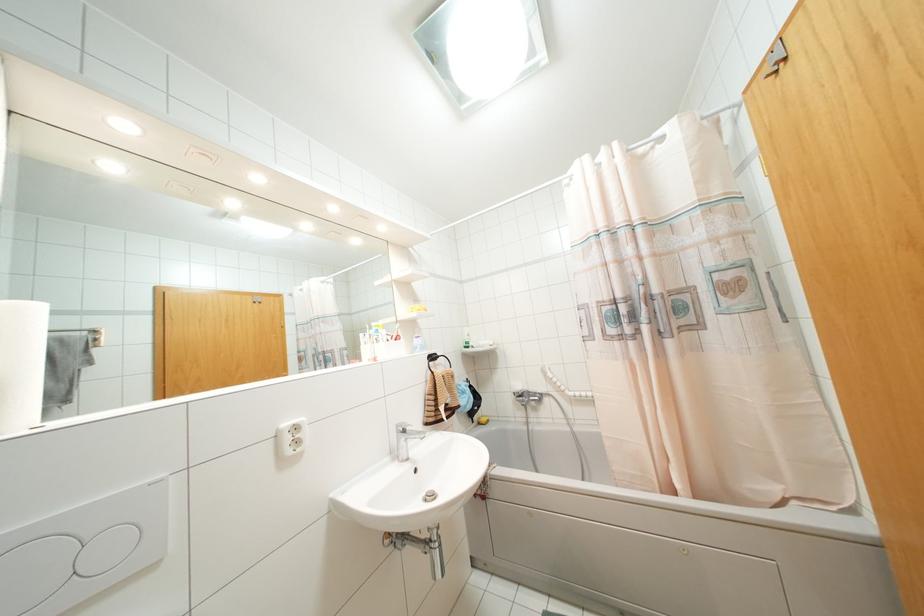
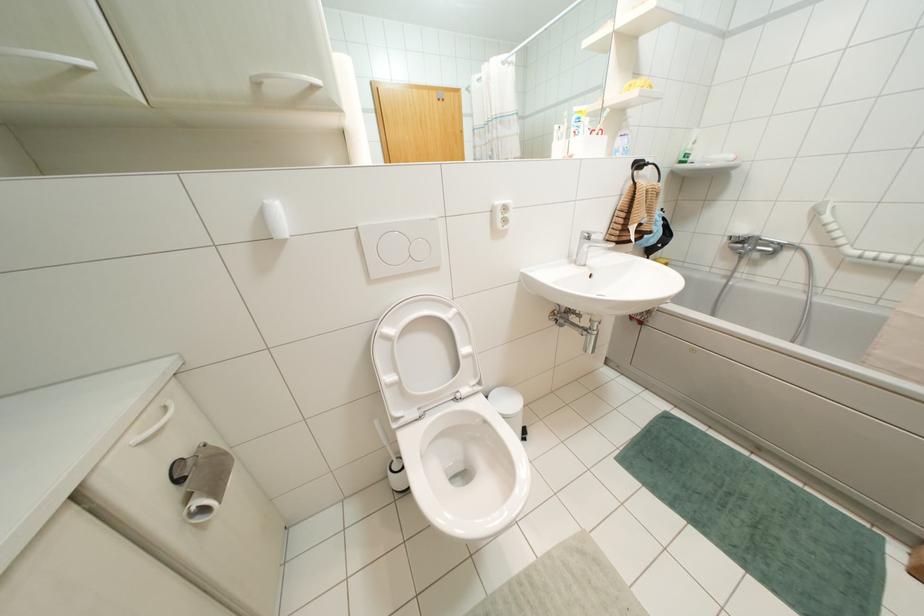
The images are taken continuously from a first-person perspective. In which direction is your viewpoint rotating?

The camera's rotation is toward left-down.